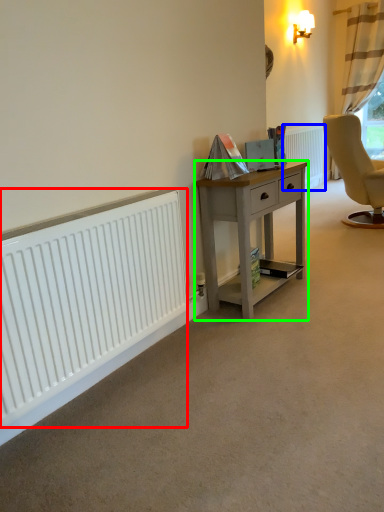
Question: Estimate the real-world distances between objects in this image. Which object is closer to radiator (highlighted by a red box), radiator (highlighted by a blue box) or desk (highlighted by a green box)?

Choices:
 (A) radiator
 (B) desk

Answer: (B)